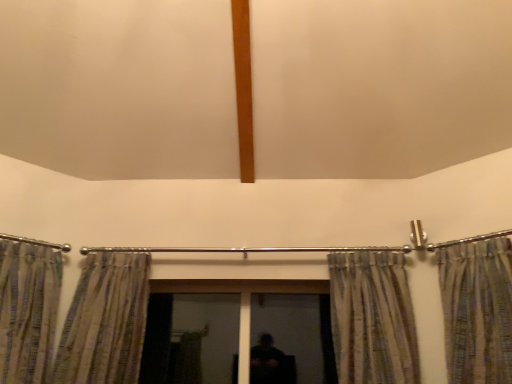
Question: Should I look upward or downward to see transparent glass screen door at center, the second screen door in the right-to-left sequence?

Choices:
 (A) up
 (B) down

Answer: (B)

Question: Is striped fabric curtain at right, marked as the third curtain in a left-to-right arrangement, thinner than metallic striped curtain at right, the fourth curtain viewed from the left?

Choices:
 (A) no
 (B) yes

Answer: (B)

Question: Does striped fabric curtain at right, marked as the third curtain in a left-to-right arrangement, have a greater height compared to metallic striped curtain at right, which is counted as the first curtain, starting from the right?

Choices:
 (A) no
 (B) yes

Answer: (A)

Question: Can you confirm if striped fabric curtain at right, acting as the 2th curtain starting from the right, is smaller than metallic striped curtain at right, the fourth curtain viewed from the left?

Choices:
 (A) yes
 (B) no

Answer: (A)

Question: Is striped fabric curtain at right, acting as the 2th curtain starting from the right, touching metallic striped curtain at right, which is counted as the first curtain, starting from the right?

Choices:
 (A) yes
 (B) no

Answer: (B)

Question: Is striped fabric curtain at right, marked as the third curtain in a left-to-right arrangement, positioned with its back to metallic striped curtain at right, the fourth curtain viewed from the left?

Choices:
 (A) yes
 (B) no

Answer: (B)

Question: Is striped fabric curtain at right, marked as the third curtain in a left-to-right arrangement, to the left of metallic striped curtain at right, the fourth curtain viewed from the left, from the viewer's perspective?

Choices:
 (A) yes
 (B) no

Answer: (A)

Question: Considering the relative sizes of black matte screen door at center, placed as the 1th screen door when sorted from right to left, and metallic striped curtain at right, which is counted as the first curtain, starting from the right, in the image provided, is black matte screen door at center, placed as the 1th screen door when sorted from right to left, bigger than metallic striped curtain at right, which is counted as the first curtain, starting from the right,?

Choices:
 (A) no
 (B) yes

Answer: (A)

Question: Does black matte screen door at center, acting as the second screen door starting from the left, lie behind metallic striped curtain at right, which is counted as the first curtain, starting from the right?

Choices:
 (A) yes
 (B) no

Answer: (A)

Question: Would you say black matte screen door at center, placed as the 1th screen door when sorted from right to left, is outside metallic striped curtain at right, the fourth curtain viewed from the left?

Choices:
 (A) yes
 (B) no

Answer: (A)

Question: From the image's perspective, would you say black matte screen door at center, placed as the 1th screen door when sorted from right to left, is shown under metallic striped curtain at right, the fourth curtain viewed from the left?

Choices:
 (A) yes
 (B) no

Answer: (A)

Question: Is black matte screen door at center, acting as the second screen door starting from the left, turned away from metallic striped curtain at right, the fourth curtain viewed from the left?

Choices:
 (A) yes
 (B) no

Answer: (B)

Question: Can you confirm if black matte screen door at center, placed as the 1th screen door when sorted from right to left, is smaller than metallic striped curtain at right, which is counted as the first curtain, starting from the right?

Choices:
 (A) no
 (B) yes

Answer: (B)

Question: Is striped fabric curtain at right, acting as the 2th curtain starting from the right, smaller than transparent glass screen door at center, the second screen door in the right-to-left sequence?

Choices:
 (A) yes
 (B) no

Answer: (B)